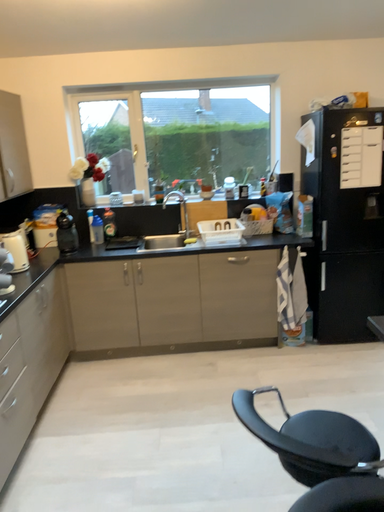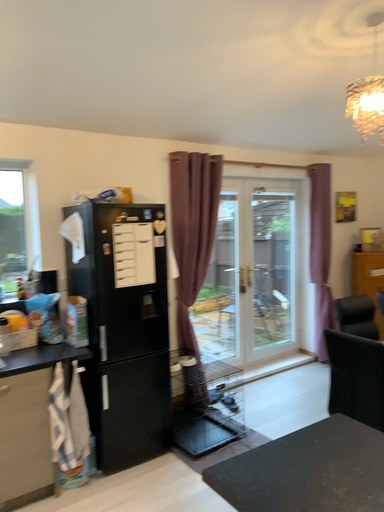
Question: How did the camera likely rotate when shooting the video?

Choices:
 (A) rotated downward
 (B) rotated upward

Answer: (B)